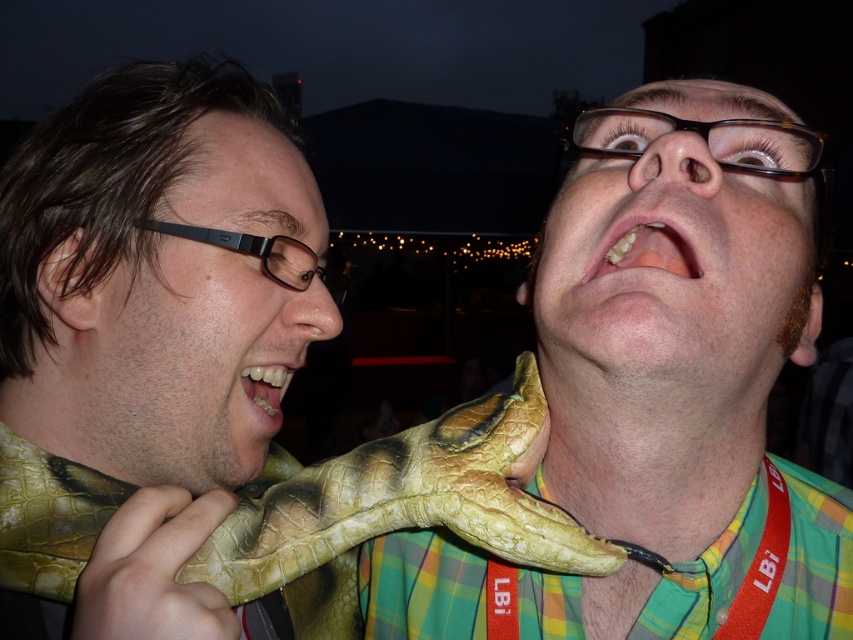
Based on the coordinates provided, which object is located at point (395, 509) in the image?

The leathery yellow green python at center is located at point (395, 509).